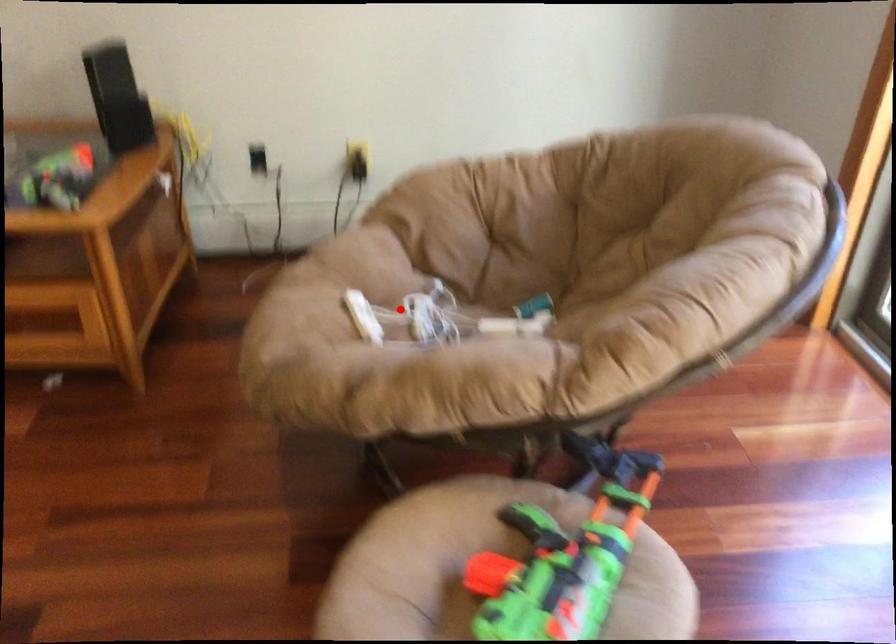
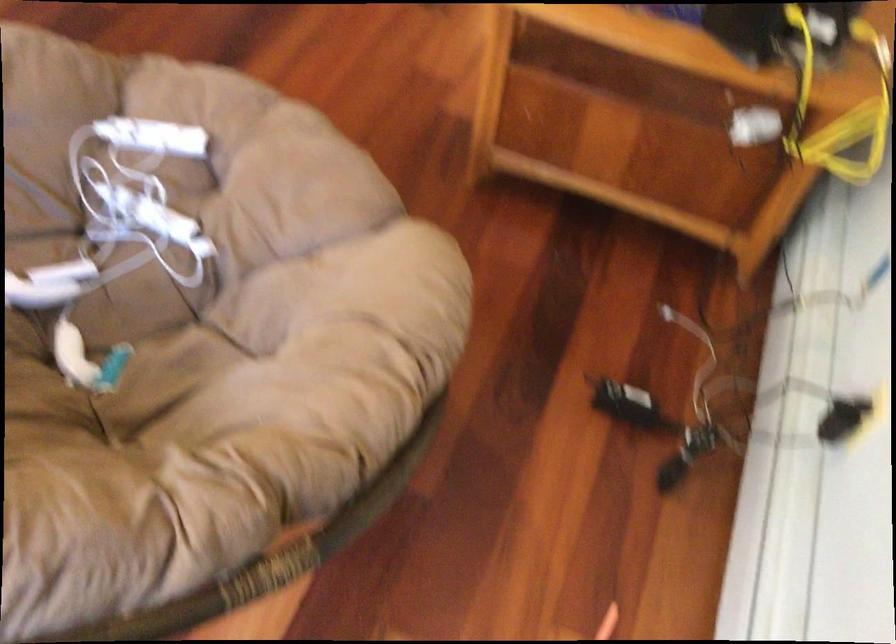
Question: I am providing you with two images of the same scene from different viewpoints. Image1 has a red point marked. In image2, the corresponding 3D location appears at what relative position? Reply with the corresponding letter.

Choices:
 (A) Closer
 (B) Farther

Answer: (A)